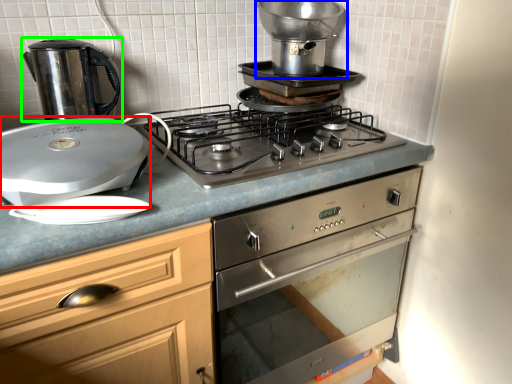
Question: Estimate the real-world distances between objects in this image. Which object is closer to kitchen appliance (highlighted by a red box), kitchen appliance (highlighted by a blue box) or kitchen appliance (highlighted by a green box)?

Choices:
 (A) kitchen appliance
 (B) kitchen appliance

Answer: (B)